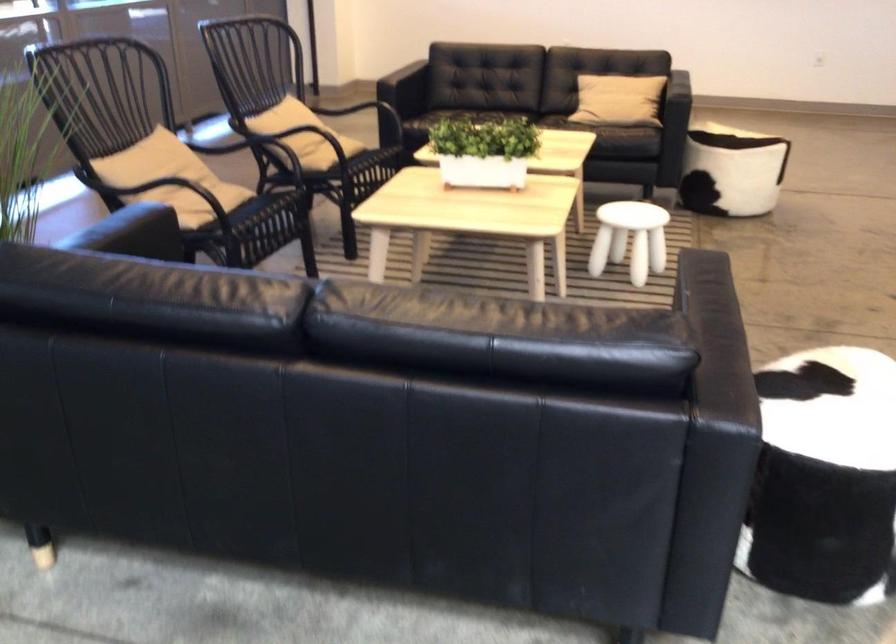
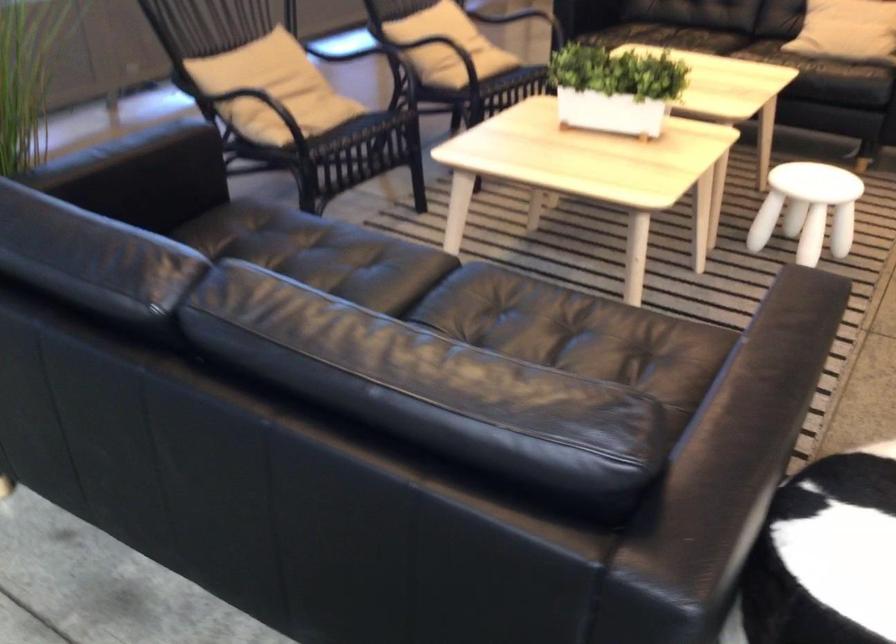
Where in the second image is the point corresponding to (294,134) from the first image?

(433, 43)